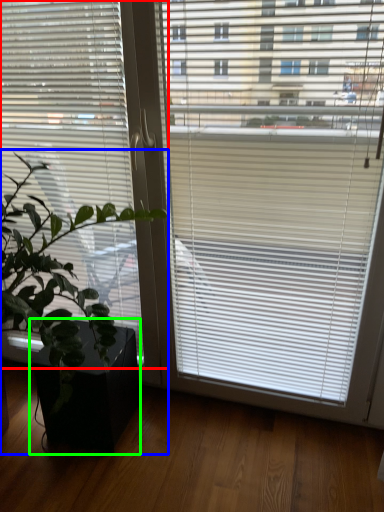
Question: Which object is positioned closest to window blind (highlighted by a red box)? Select from houseplant (highlighted by a blue box) and flowerpot (highlighted by a green box).

Choices:
 (A) houseplant
 (B) flowerpot

Answer: (A)